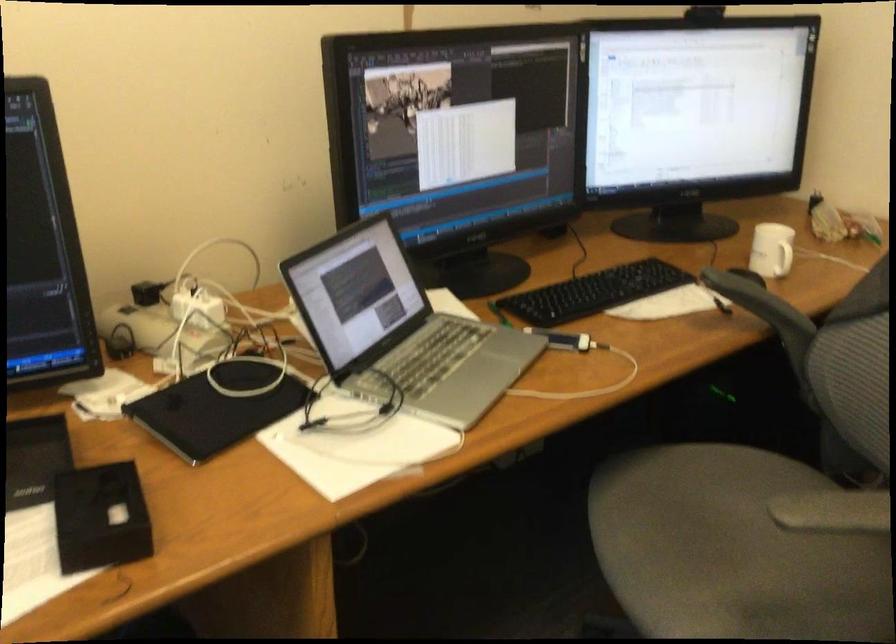
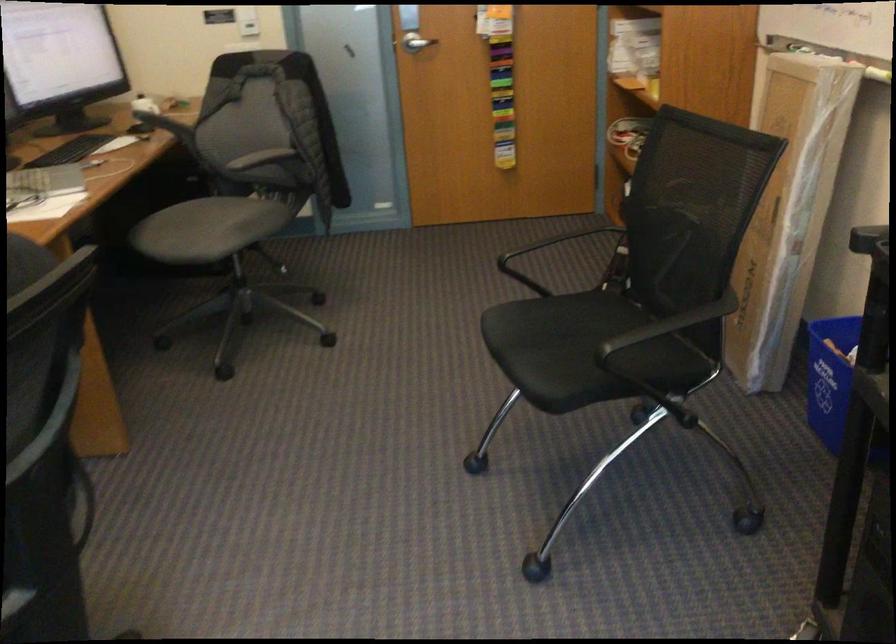
Locate, in the second image, the point that corresponds to (x=734, y=310) in the first image.

(158, 120)